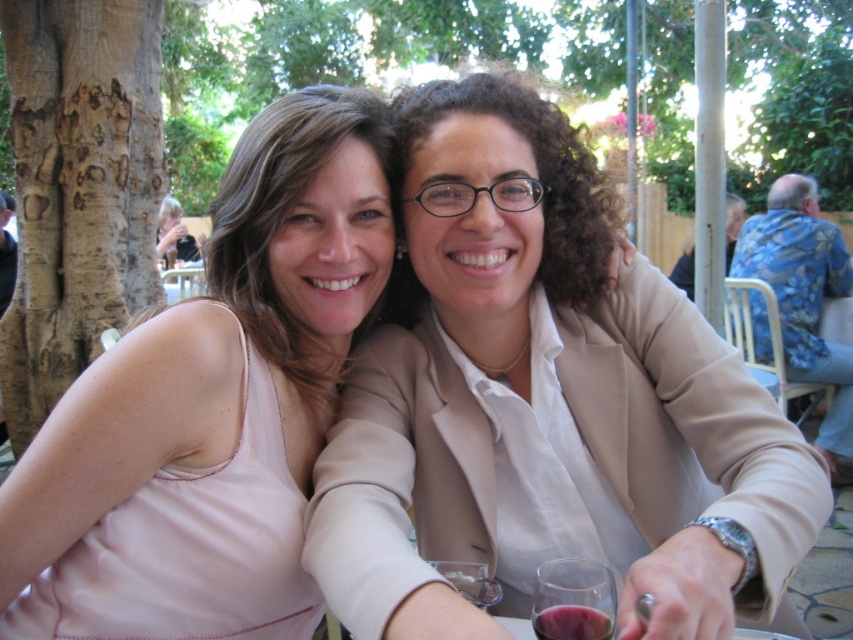
Question: Estimate the real-world distances between objects in this image. Which object is farther from the translucent glass wine at lower center?

Choices:
 (A) pink fabric tank top at upper left
 (B) transparent plastic wine glass at lower center
 (C) matte beige blazer at center

Answer: (A)

Question: Which object appears closest to the camera in this image?

Choices:
 (A) translucent glass wine at lower center
 (B) matte beige blazer at center
 (C) pink fabric tank top at upper left
 (D) translucent glass at lower center

Answer: (B)

Question: Which point is closer to the camera?

Choices:
 (A) (218, 349)
 (B) (538, 608)
 (C) (457, 584)
 (D) (564, 403)

Answer: (B)

Question: Is pink fabric tank top at upper left closer to the viewer compared to transparent plastic wine glass at lower center?

Choices:
 (A) yes
 (B) no

Answer: (B)

Question: Is translucent glass at lower center below transparent plastic wine glass at lower center?

Choices:
 (A) no
 (B) yes

Answer: (A)

Question: Is translucent glass at lower center bigger than translucent glass wine at lower center?

Choices:
 (A) no
 (B) yes

Answer: (B)